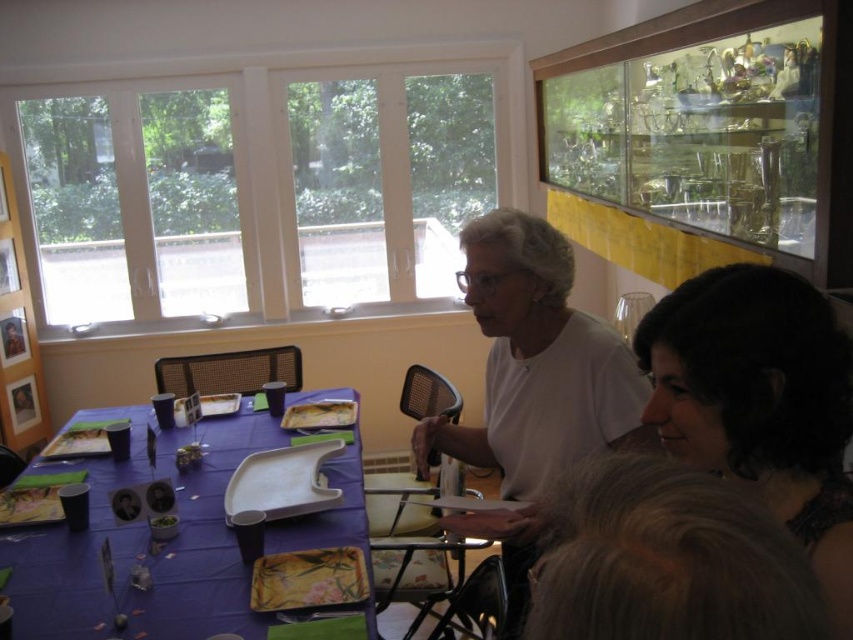
Is dark brown hair at upper right taller than purple fabric table at lower left?

Correct, dark brown hair at upper right is much taller as purple fabric table at lower left.

How far apart are dark brown hair at upper right and purple fabric table at lower left?

A distance of 3.81 feet exists between dark brown hair at upper right and purple fabric table at lower left.

Is point (642, 369) farther from viewer compared to point (173, 451)?

No, it is in front of (173, 451).

At what (x,y) coordinates should I click in order to perform the action: click on dark brown hair at upper right. Please return your answer as a coordinate pair (x, y). The image size is (853, 640). Looking at the image, I should click on (759, 403).